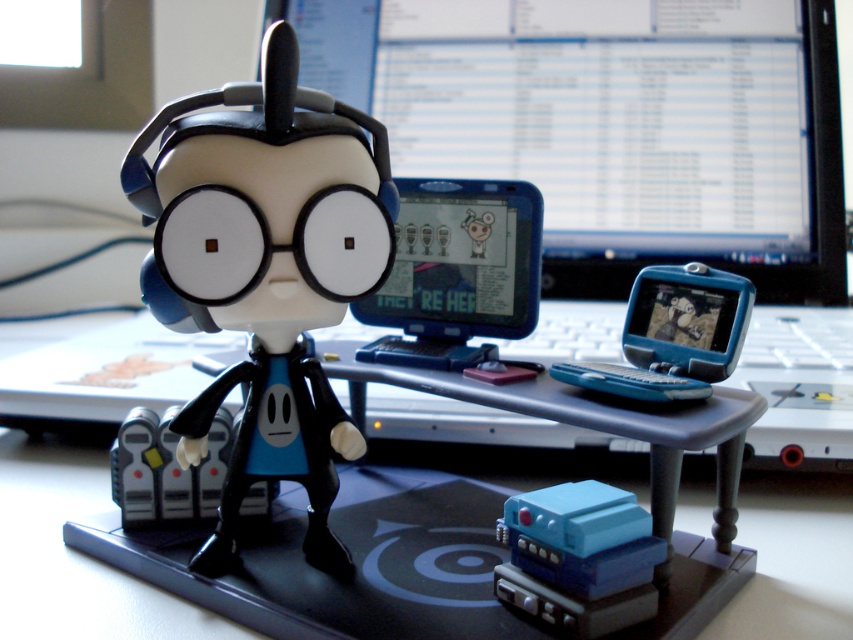
The width and height of the screenshot is (853, 640). What do you see at coordinates (672, 336) in the screenshot?
I see `blue plastic toy at center` at bounding box center [672, 336].

Is blue plastic toy at center in front of white matte robot at center?

Yes, it is in front of white matte robot at center.

You are a GUI agent. You are given a task and a screenshot of the screen. Output one action in this format:
    pyautogui.click(x=<x>, y=<y>)
    Task: Click on the blue plastic toy at center
    This screenshot has height=640, width=853.
    Given the screenshot: What is the action you would take?
    pyautogui.click(x=672, y=336)

Who is lower down, blue plastic computer at center or matte black figurine at center?

matte black figurine at center

Between point (469, 1) and point (285, 124), which one is positioned in front?

Point (285, 124) is more forward.

Where is `blue plastic computer at center`? Image resolution: width=853 pixels, height=640 pixels. blue plastic computer at center is located at coordinates (631, 157).

Which of these two, blue plastic speaker at lower center or white matte robot at center, stands shorter?

blue plastic speaker at lower center is shorter.

Is blue plastic speaker at lower center closer to camera compared to white matte robot at center?

That is True.

What are the coordinates of `blue plastic speaker at lower center` in the screenshot? It's located at (579, 557).